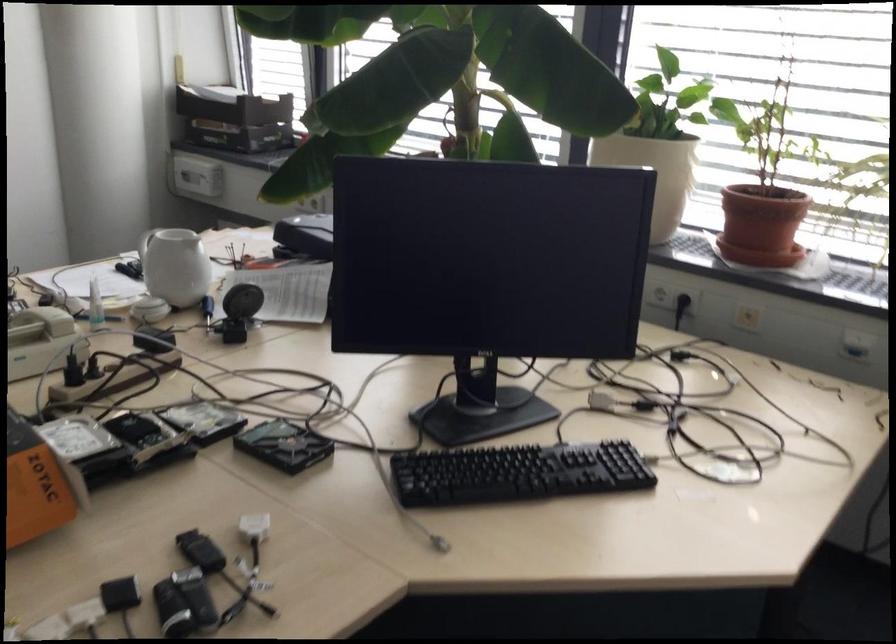
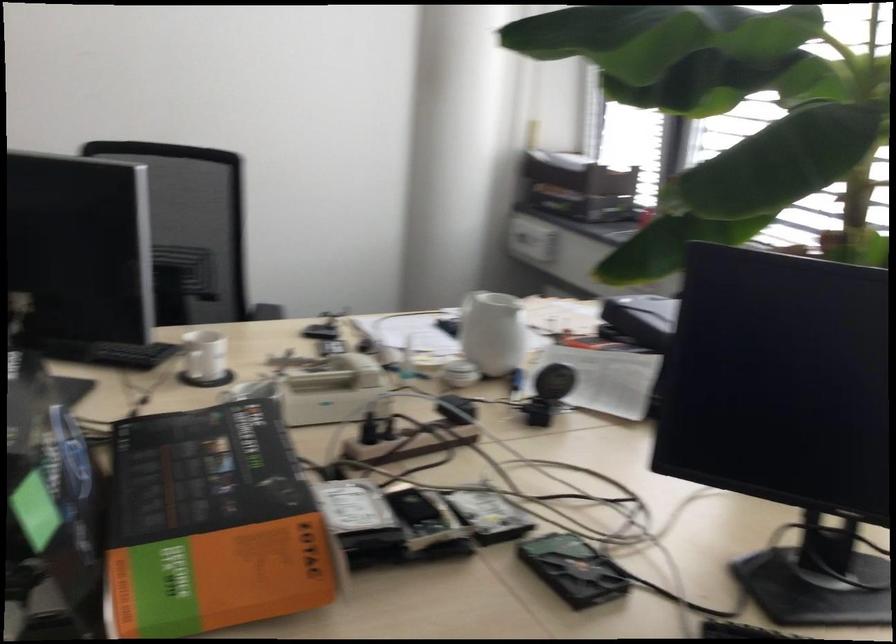
Question: The images are taken continuously from a first-person perspective. In which direction is your viewpoint rotating?

Choices:
 (A) Left
 (B) Right
 (C) Up
 (D) Down

Answer: (A)